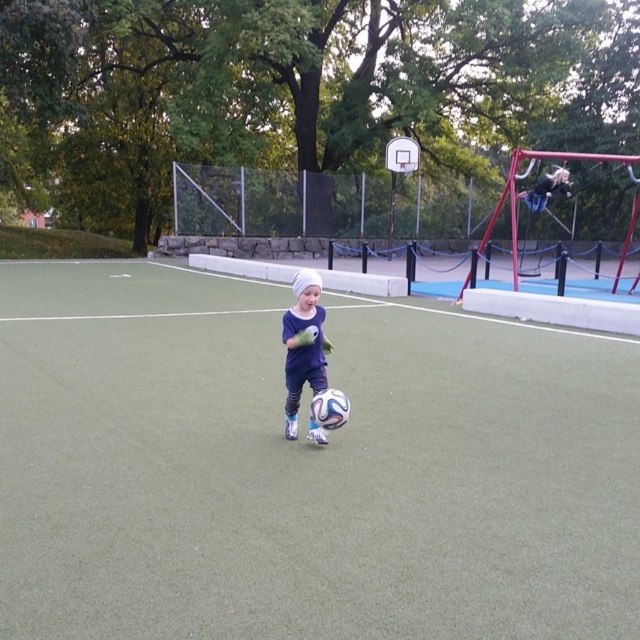
You are standing in the park and want to kick a soccer ball from where you are to the green artificial turf at center. Can you do it in one kick without the ball going over the fence?

The distance between you and the green artificial turf at center is 3.14 meters. Since the fence is part of the play area enclosure, and assuming typical soccer kicking distances, a 3.14 meter kick is feasible without the ball going over the fence.

You are a parent watching your child play in the park. You notice the matte blue soccer ball at center and the metallic silver basketball hoop at upper center. Which object is closer to the ground?

The matte blue soccer ball at center is closer to the ground because it is shorter than the metallic silver basketball hoop at upper center.